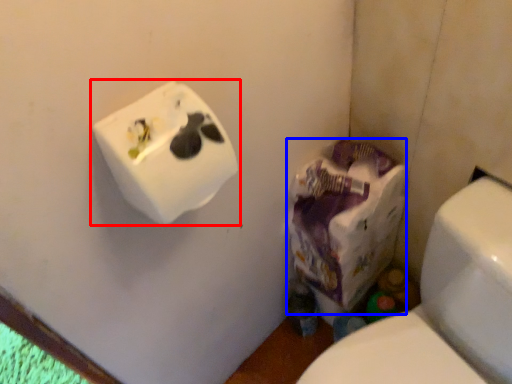
Question: Among these objects, which one is nearest to the camera, toilet paper (highlighted by a red box) or paper bag (highlighted by a blue box)?

Choices:
 (A) toilet paper
 (B) paper bag

Answer: (A)